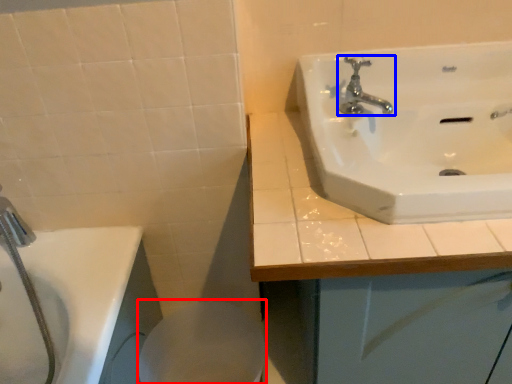
Question: Which object appears closest to the camera in this image, bidet (highlighted by a red box) or tap (highlighted by a blue box)?

Choices:
 (A) bidet
 (B) tap

Answer: (B)